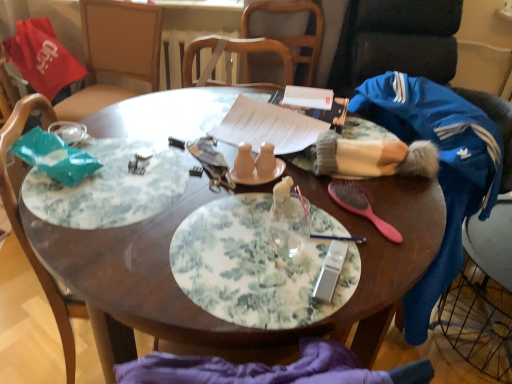
This screenshot has width=512, height=384. I want to click on free space to the right of pink plastic hairbrush at center-right, which is the fifth tableware from left to right, so click(x=415, y=207).